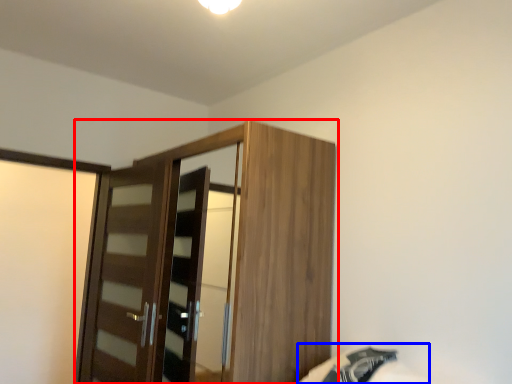
Question: Which object is closer to the camera taking this photo, cupboard (highlighted by a red box) or bed (highlighted by a blue box)?

Choices:
 (A) cupboard
 (B) bed

Answer: (B)